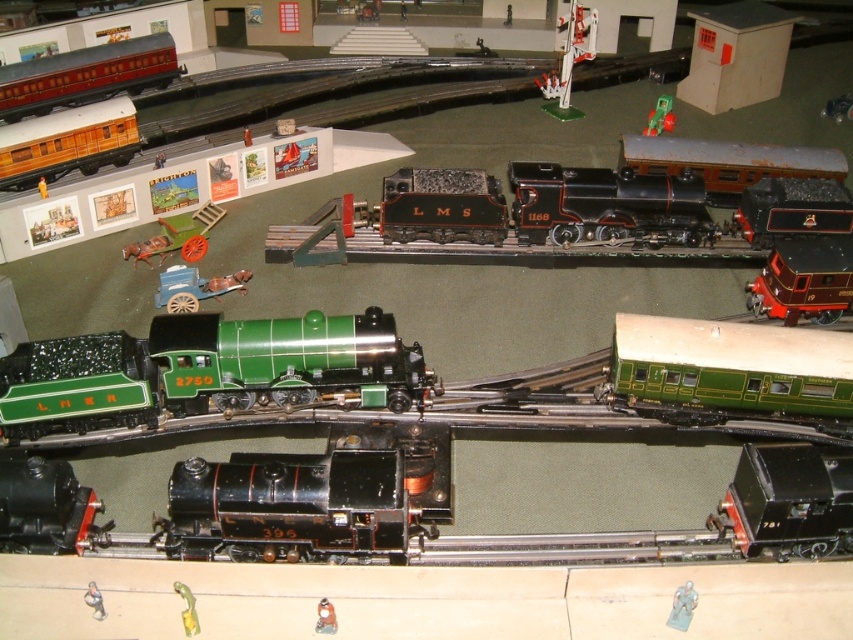
Who is more distant from viewer, (x=659, y=102) or (x=173, y=588)?

Point (x=659, y=102)

Based on the photo, between green matte toy at center and metallic gold figurine at lower center, which one has less height?

metallic gold figurine at lower center

Does point (671, 122) come behind point (183, 595)?

Yes, it is behind point (183, 595).

This screenshot has width=853, height=640. I want to click on green matte toy at center, so click(660, 116).

Who is more forward, (x=170, y=250) or (x=187, y=289)?

Point (x=187, y=289) is in front.

Is wooden cart at lower left wider than blue plastic cart at center?

No.

Is point (183, 252) less distant than point (196, 285)?

That is False.

This screenshot has height=640, width=853. I want to click on wooden cart at lower left, so click(177, 236).

Is metallic silver figure at lower right positioned before brown matte toy at center?

No, it is not.

Is metallic silver figure at lower right thinner than brown matte toy at center?

In fact, metallic silver figure at lower right might be wider than brown matte toy at center.

Is point (682, 628) positioned after point (323, 602)?

Yes, point (682, 628) is farther from viewer.

You are a GUI agent. You are given a task and a screenshot of the screen. Output one action in this format:
    pyautogui.click(x=<x>, y=<y>)
    Task: Click on the metallic silver figure at lower right
    The height and width of the screenshot is (640, 853).
    Given the screenshot: What is the action you would take?
    pyautogui.click(x=682, y=605)